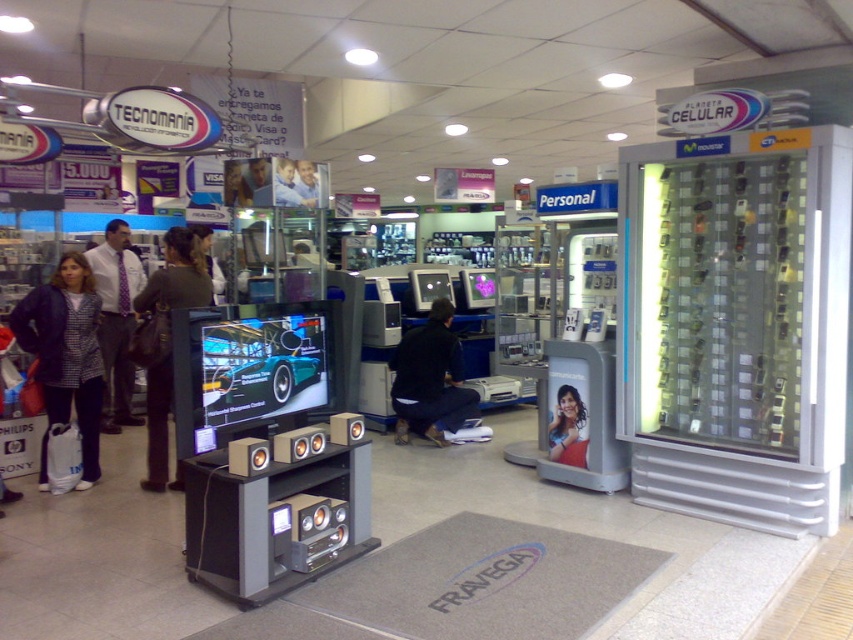
Based on the photo, is black matte clothing at center bigger than dark brown leather jacket at center?

Correct, black matte clothing at center is larger in size than dark brown leather jacket at center.

Between black matte clothing at center and dark brown leather jacket at center, which one appears on the left side from the viewer's perspective?

Positioned to the left is dark brown leather jacket at center.

The image size is (853, 640). What are the coordinates of `black matte clothing at center` in the screenshot? It's located at (430, 380).

Is dark brown leather jacket at left further to camera compared to plaid fabric jacket at left?

No, it is not.

Is point (169, 291) positioned in front of point (122, 348)?

Yes, it is in front of point (122, 348).

Where is `dark brown leather jacket at left`? dark brown leather jacket at left is located at coordinates (177, 278).

Does shiny metallic car at center have a greater height compared to dark brown leather jacket at center?

Incorrect, shiny metallic car at center's height is not larger of dark brown leather jacket at center's.

Is point (277, 364) positioned in front of point (207, 244)?

That is True.

At what (x,y) coordinates should I click in order to perform the action: click on shiny metallic car at center. Please return your answer as a coordinate pair (x, y). Looking at the image, I should click on (260, 365).